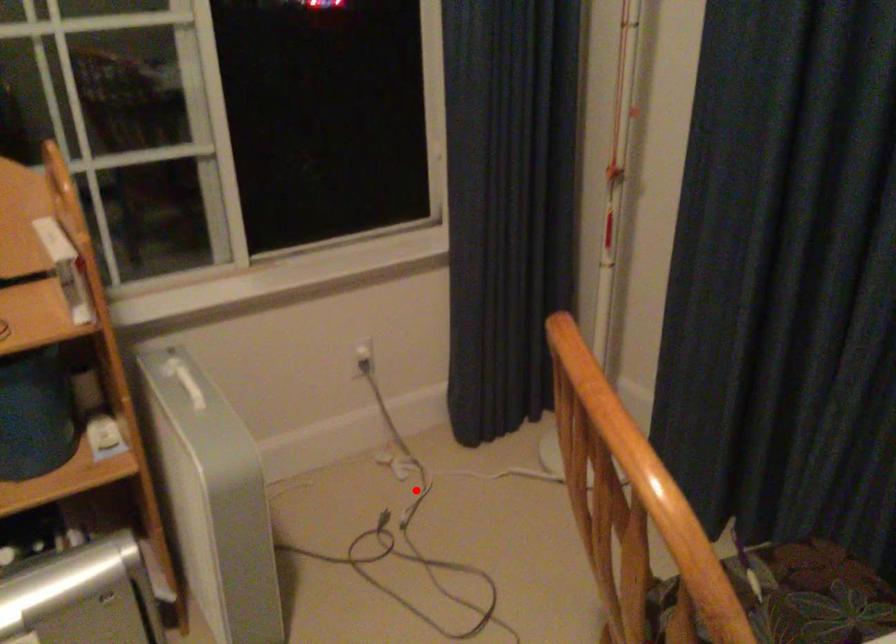
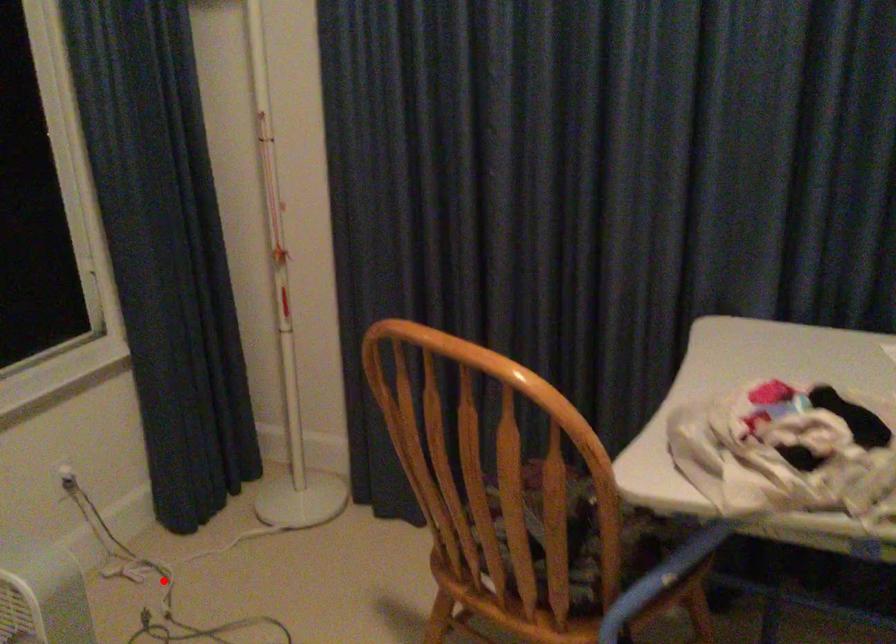
I am providing you with two images of the same scene from different viewpoints. A red point is marked on the first image and another point is marked on the second image. Does the point marked in image1 correspond to the same location as the one in image2?

Yes